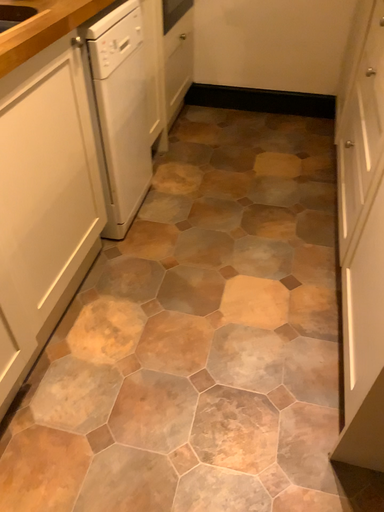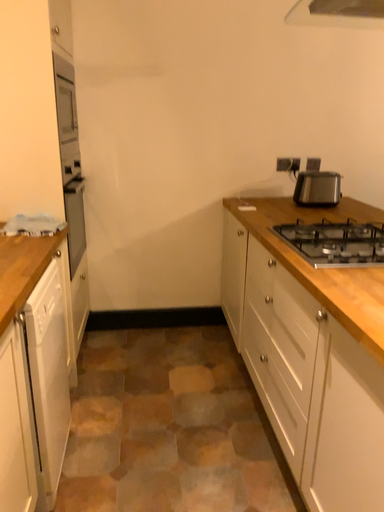
Question: Which way did the camera rotate in the video?

Choices:
 (A) rotated downward
 (B) rotated upward

Answer: (B)